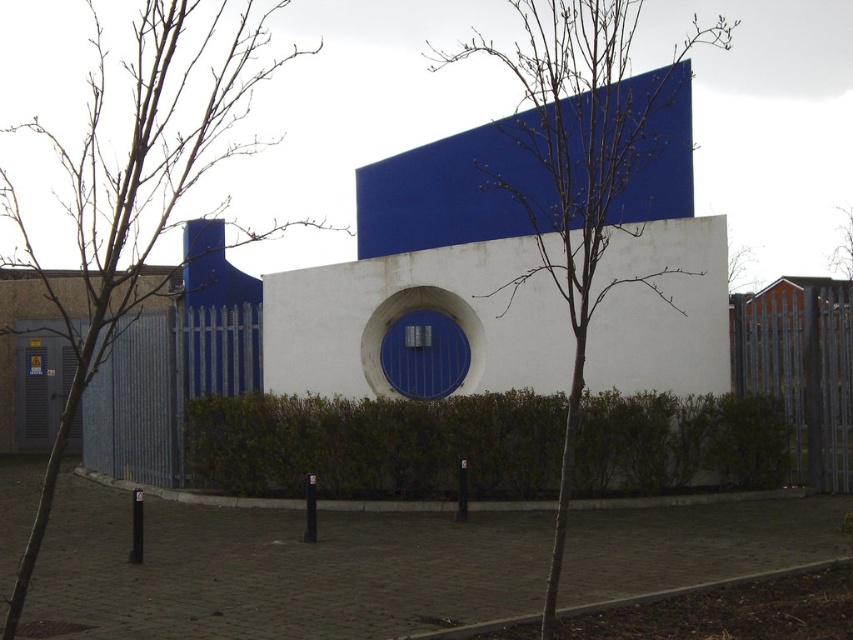
Question: Which point is closer to the camera?

Choices:
 (A) (645, 342)
 (B) (561, 461)
 (C) (850, 278)
 (D) (64, 387)

Answer: (B)

Question: Is green leafy hedge at center in front of bare branches at upper right?

Choices:
 (A) no
 (B) yes

Answer: (B)

Question: Does bare branches at center have a lesser width compared to bare branches at upper right?

Choices:
 (A) yes
 (B) no

Answer: (B)

Question: Is bare branches at left further to camera compared to bare branches at upper right?

Choices:
 (A) yes
 (B) no

Answer: (B)

Question: Which object appears farthest from the camera in this image?

Choices:
 (A) bare branches at upper right
 (B) bare branches at left
 (C) green leafy hedge at center

Answer: (A)

Question: Which of the following is the farthest from the observer?

Choices:
 (A) bare branches at left
 (B) green leafy hedge at center

Answer: (B)